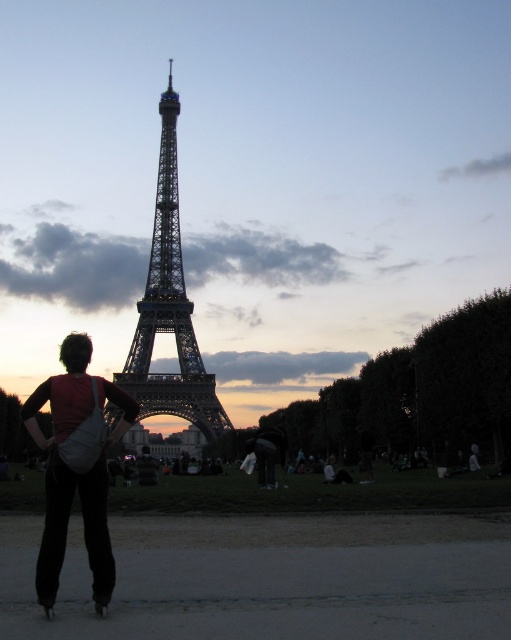
Question: Which of the following is the closest to the observer?

Choices:
 (A) metallic structure at center
 (B) matte white bag at lower left

Answer: (A)

Question: Can you confirm if matte white bag at lower left is positioned above metallic structure at center?

Choices:
 (A) yes
 (B) no

Answer: (B)

Question: Is matte white bag at lower left smaller than metallic structure at center?

Choices:
 (A) no
 (B) yes

Answer: (B)

Question: Observing the image, what is the correct spatial positioning of matte white bag at lower left in reference to metallic structure at center?

Choices:
 (A) left
 (B) right

Answer: (A)